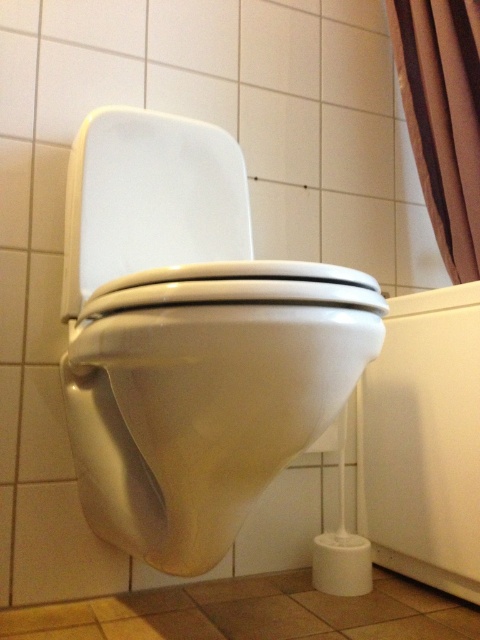
Looking at this image, who is shorter, white glossy toilet seat at center or brown fabric curtain at upper right?

white glossy toilet seat at center is shorter.

Is white glossy toilet seat at center behind brown fabric curtain at upper right?

No, it is not.

Locate an element on the screen. The image size is (480, 640). white glossy toilet seat at center is located at coordinates (149, 204).

What are the coordinates of `white glossy toilet seat at center` in the screenshot? It's located at (149, 204).

Can you confirm if white glossy toilet seat at center is taller than white matte toilet paper at lower right?

Yes, white glossy toilet seat at center is taller than white matte toilet paper at lower right.

At what (x,y) coordinates should I click in order to perform the action: click on white glossy toilet seat at center. Please return your answer as a coordinate pair (x, y). This screenshot has height=640, width=480. Looking at the image, I should click on (149, 204).

Which is in front, point (188, 218) or point (336, 576)?

Positioned in front is point (188, 218).

Where is `white glossy toilet seat at center`? white glossy toilet seat at center is located at coordinates (149, 204).

Between brown fabric curtain at upper right and white matte toilet paper at lower right, which one appears on the left side from the viewer's perspective?

From the viewer's perspective, white matte toilet paper at lower right appears more on the left side.

Locate an element on the screen. brown fabric curtain at upper right is located at coordinates (443, 118).

Locate an element on the screen. This screenshot has height=640, width=480. brown fabric curtain at upper right is located at coordinates (443, 118).

Identify the location of brown fabric curtain at upper right. (443, 118).